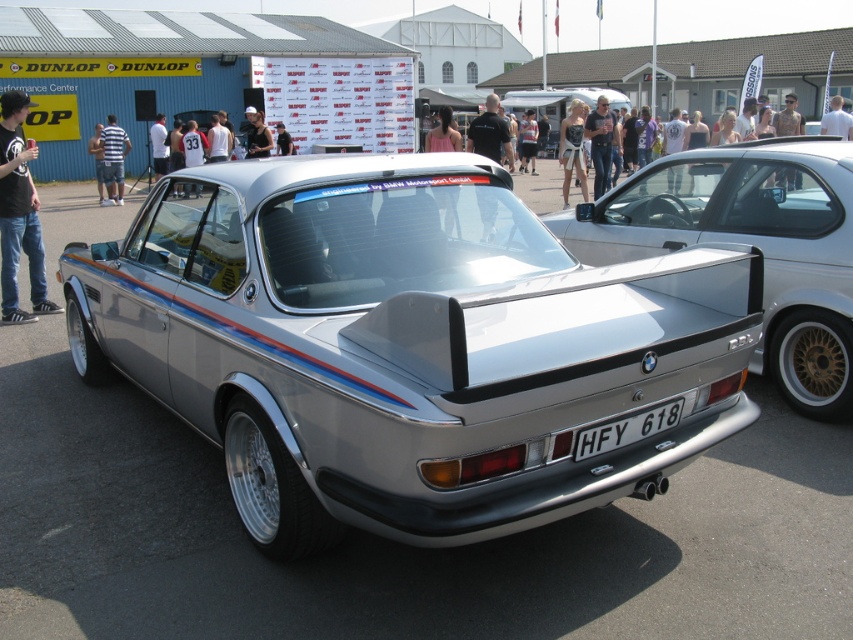
You are standing at the front of the silver BMW 3.0 CSL at the exhibition. You notice two points marked on the car. One is at point (833, 100) and the other at point (96, 125). From your position, which point is closer to you?

Point (833, 100) is in front of point (96, 125), so from your position at the front of the silver BMW 3.0 CSL, the point (833, 100) is closer to you.

You are attending an automotive event and see two people wearing denim jeans at center and white shirt at center. Which clothing item is located to the left?

The denim jeans at center is positioned on the left side of white shirt at center, so the denim jeans at center is located to the left.